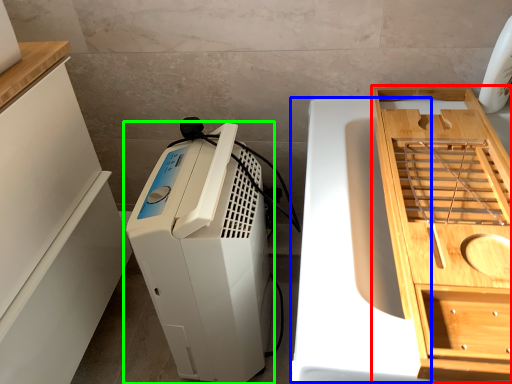
Question: Based on their relative distances, which object is nearer to cabinetry (highlighted by a red box)? Choose from wide (highlighted by a blue box) and home appliance (highlighted by a green box).

Choices:
 (A) wide
 (B) home appliance

Answer: (A)